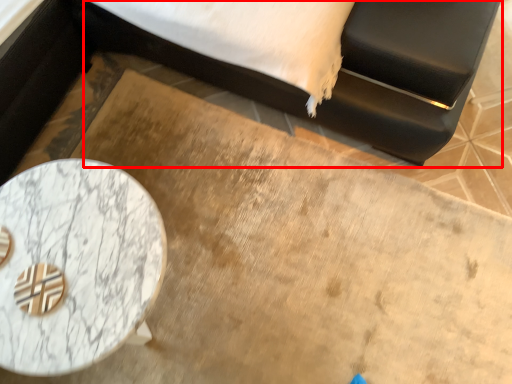
Question: From the image's perspective, considering the relative positions of bed (annotated by the red box) and table in the image provided, where is bed (annotated by the red box) located with respect to the staircase?

Choices:
 (A) above
 (B) below

Answer: (A)